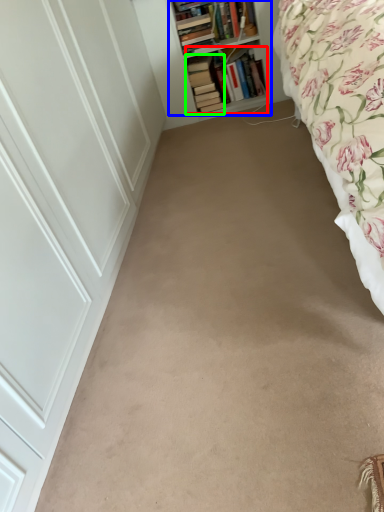
Question: Based on their relative distances, which object is farther from book (highlighted by a red box)? Choose from shelf (highlighted by a blue box) and book (highlighted by a green box).

Choices:
 (A) shelf
 (B) book

Answer: (A)